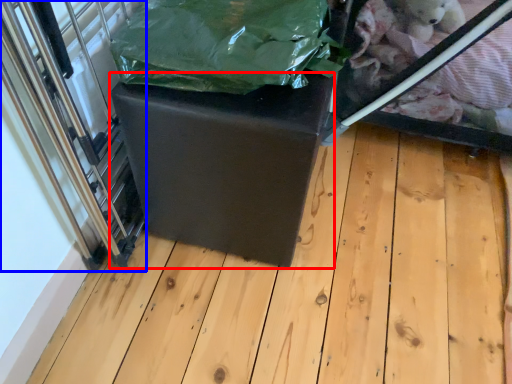
Question: Which point is further to the camera, table (highlighted by a red box) or glass door (highlighted by a blue box)?

Choices:
 (A) table
 (B) glass door

Answer: (A)